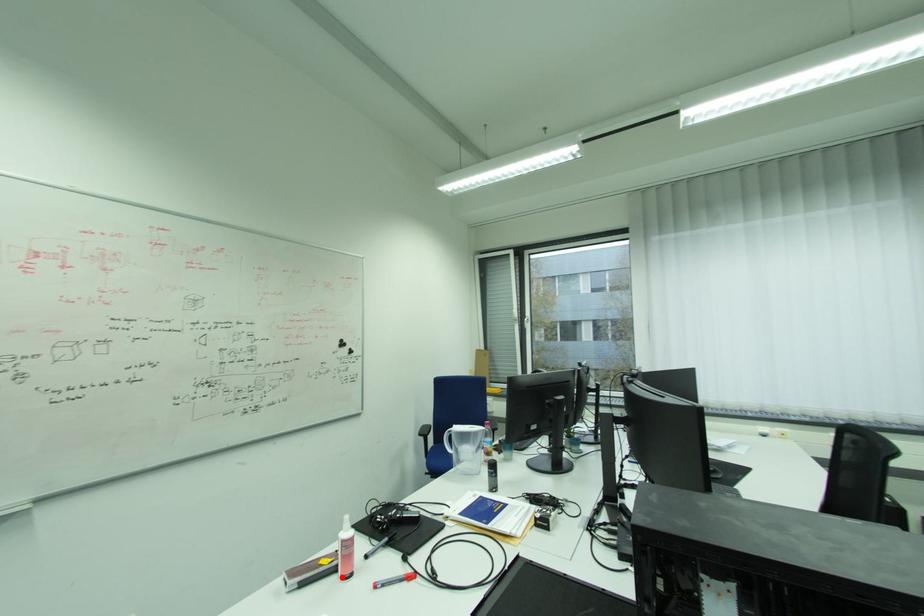
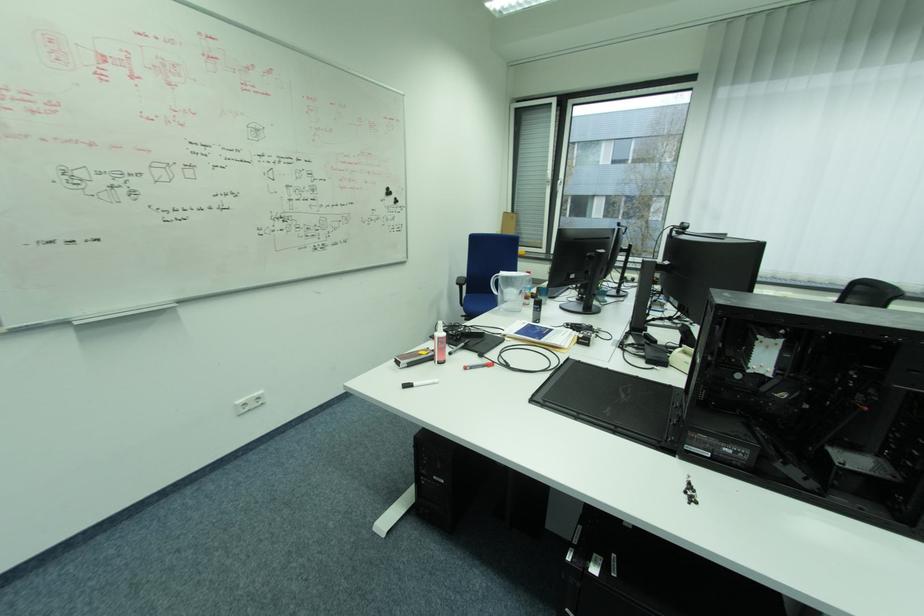
In the second image, find the point that corresponds to the highlighted location in the first image.

(439, 363)